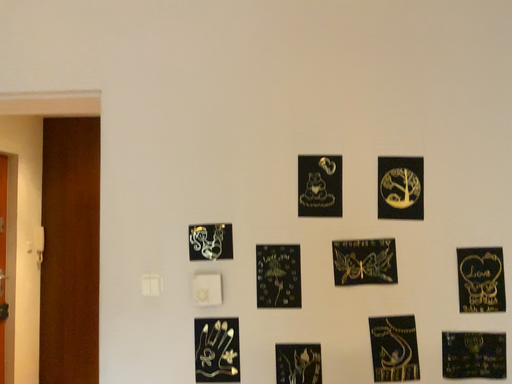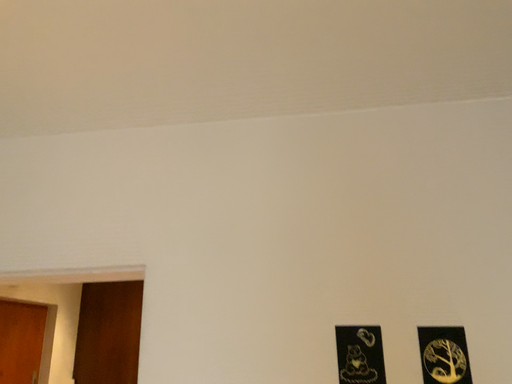
Question: How did the camera likely rotate when shooting the video?

Choices:
 (A) rotated upward
 (B) rotated downward

Answer: (A)